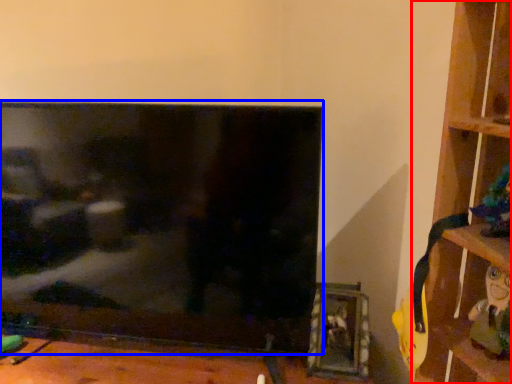
Question: Which object appears farthest to the camera in this image, shelf (highlighted by a red box) or television (highlighted by a blue box)?

Choices:
 (A) shelf
 (B) television

Answer: (B)